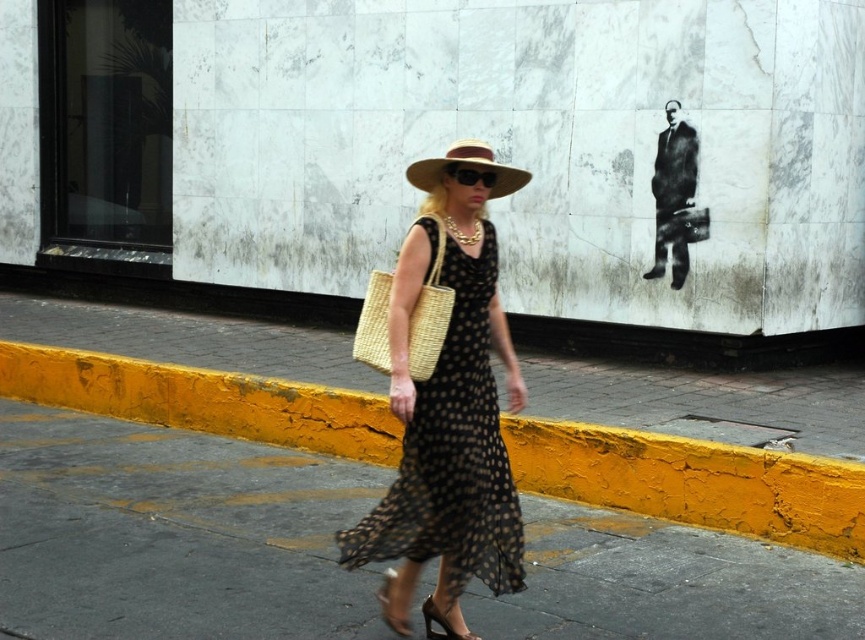
Can you confirm if black dotted fabric maxi dress at upper right is taller than shiny brown leather sandal at lower center?

Indeed, black dotted fabric maxi dress at upper right has a greater height compared to shiny brown leather sandal at lower center.

Which is more to the right, black dotted fabric maxi dress at upper right or shiny brown leather sandal at lower center?

Positioned to the right is black dotted fabric maxi dress at upper right.

Locate an element on the screen. Image resolution: width=865 pixels, height=640 pixels. black dotted fabric maxi dress at upper right is located at coordinates (676, 196).

Could you measure the distance between black dotted fabric maxi dress at upper right and shiny gold sandal at lower center?

black dotted fabric maxi dress at upper right and shiny gold sandal at lower center are 3.87 meters apart.

Which of these two, black dotted fabric maxi dress at upper right or shiny gold sandal at lower center, stands taller?

black dotted fabric maxi dress at upper right is taller.

The width and height of the screenshot is (865, 640). I want to click on black dotted fabric maxi dress at upper right, so click(676, 196).

This screenshot has width=865, height=640. Find the location of `woven straw bag at center`. woven straw bag at center is located at coordinates (428, 314).

Between point (450, 296) and point (459, 156), which one is positioned in front?

Point (450, 296) is in front.

You are a GUI agent. You are given a task and a screenshot of the screen. Output one action in this format:
    pyautogui.click(x=<x>, y=<y>)
    Task: Click on the woven straw bag at center
    
    Given the screenshot: What is the action you would take?
    pyautogui.click(x=428, y=314)